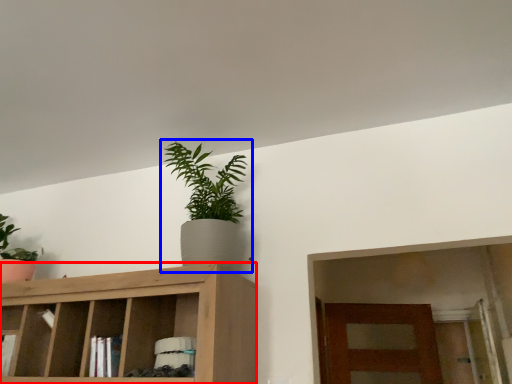
Question: Which object is closer to the camera taking this photo, cabinetry (highlighted by a red box) or houseplant (highlighted by a blue box)?

Choices:
 (A) cabinetry
 (B) houseplant

Answer: (A)